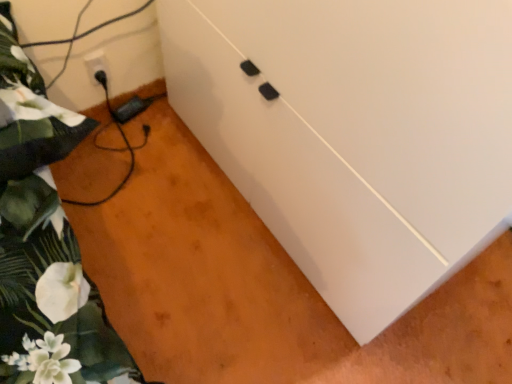
Image resolution: width=512 pixels, height=384 pixels. I want to click on vacant space that is to the left of white matte cabinet at center, so click(149, 190).